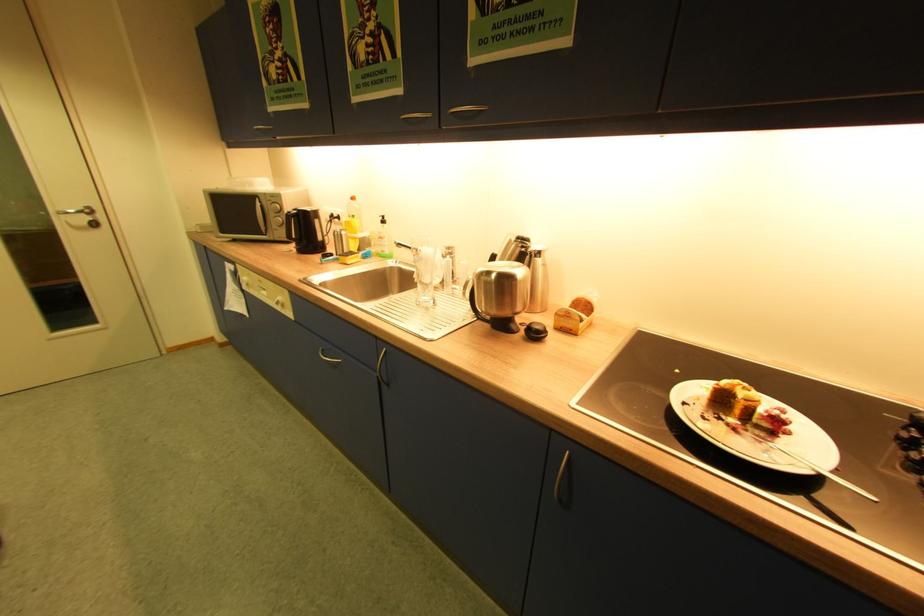
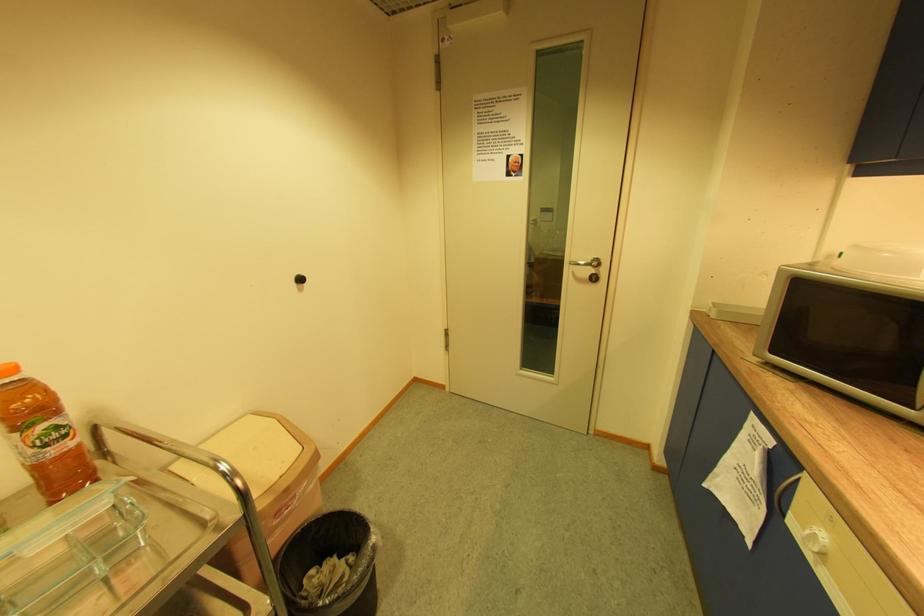
In the second image, find the point that corresponds to [94,219] in the first image.

(598, 272)